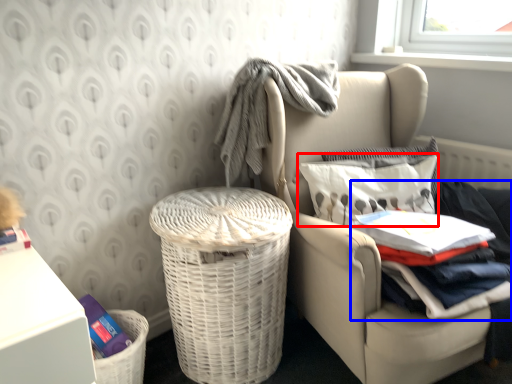
Question: Which object is closer to the camera taking this photo, pillow (highlighted by a red box) or clothing (highlighted by a blue box)?

Choices:
 (A) pillow
 (B) clothing

Answer: (B)